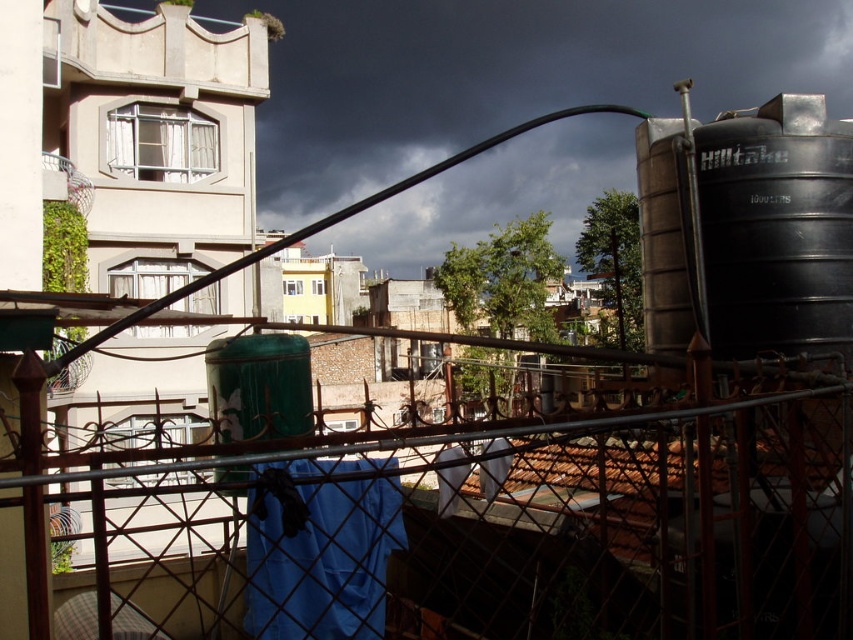
You are a maintenance worker needing to reach the black matte water tank at right from the rusty metal fence at center. Given that your ladder is 5 meters long, will it be sufficient to bridge the gap between them?

The distance between the rusty metal fence at center and the black matte water tank at right is 6.41 meters. Since the ladder is only 5 meters long, it will not be sufficient to bridge the gap between them.

You are a maintenance worker inspecting the balcony. You need to assess whether the rusty metal fence at center can support a new sign that weighs the same as the black matte water tank at right. Given that the fence is larger, can it hold the sign?

The rusty metal fence at center has a larger size compared to the black matte water tank at right. Since the fence is larger, it likely has a stronger structure and can support the weight of the sign equivalent to the tank.